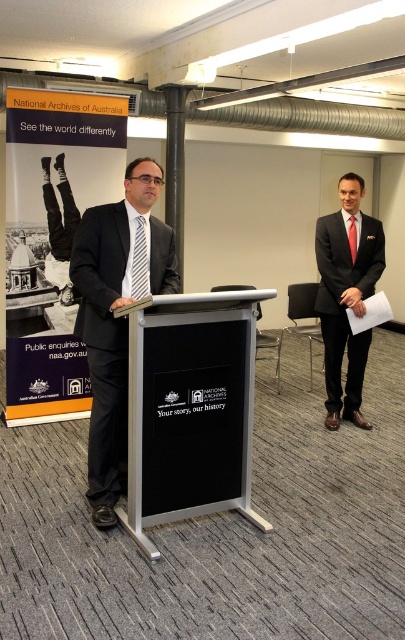
Question: Is matte black suit at center closer to the viewer compared to black silk tie at center?

Choices:
 (A) no
 (B) yes

Answer: (B)

Question: Among these points, which one is nearest to the camera?

Choices:
 (A) (136, 264)
 (B) (17, 384)

Answer: (A)

Question: Is metallic silver podium at center wider than black silk tie at center?

Choices:
 (A) yes
 (B) no

Answer: (A)

Question: Does matte black suit at center appear over black plastic pole at upper center?

Choices:
 (A) yes
 (B) no

Answer: (B)

Question: Which point appears closest to the camera in this image?

Choices:
 (A) (134, 243)
 (B) (147, 520)
 (C) (98, 99)

Answer: (B)

Question: Which point is closer to the camera taking this photo?

Choices:
 (A) (355, 230)
 (B) (176, 256)

Answer: (B)